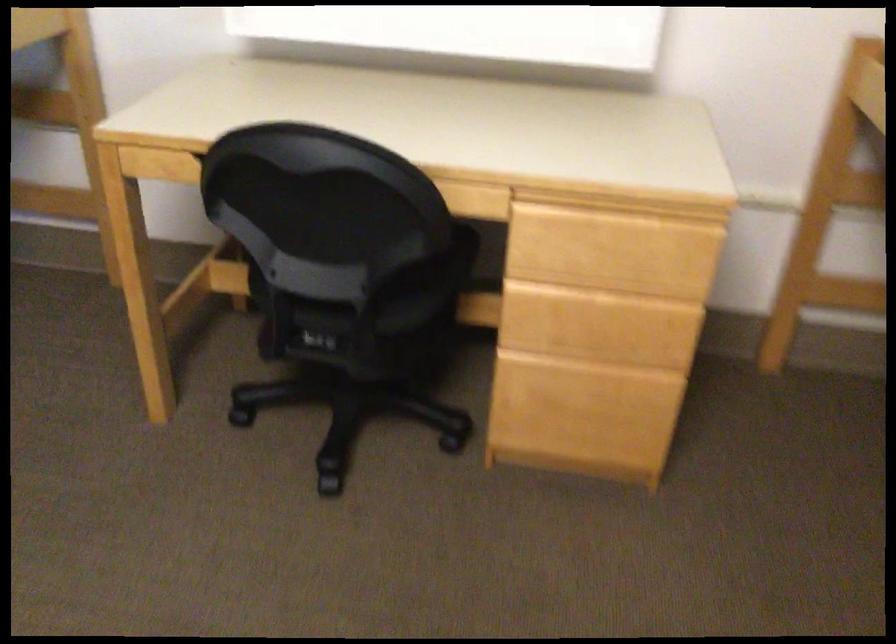
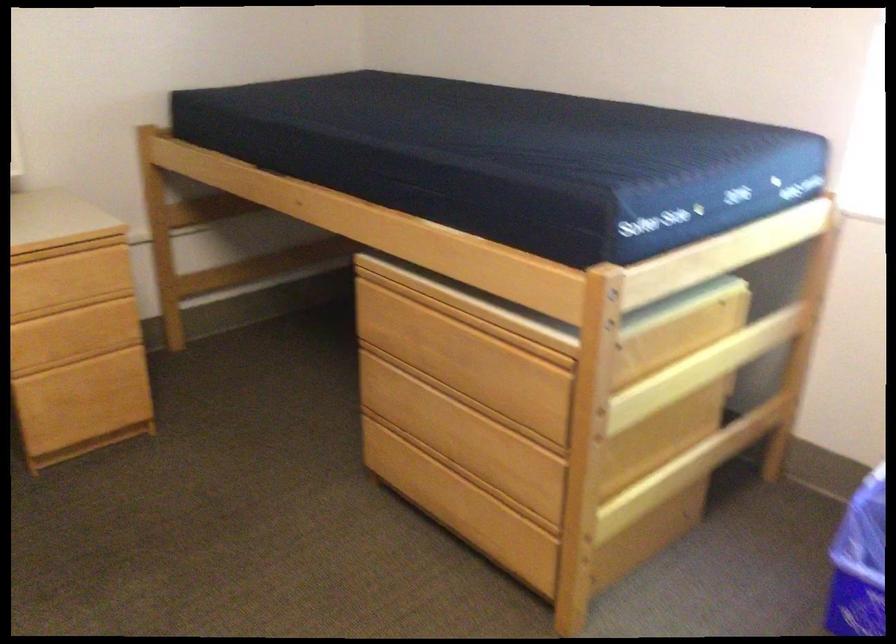
Where in the second image is the point corresponding to pixel 627 216 from the first image?

(65, 250)